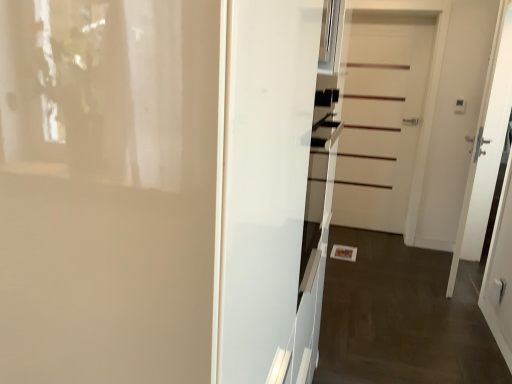
Question: Is white matte door at center, positioned as the 2th door in back-to-front order, wider than white matte door at center, marked as the 1th door in a back-to-front arrangement?

Choices:
 (A) no
 (B) yes

Answer: (B)

Question: Can you see white matte door at center, which ranks as the third door in left-to-right order, touching white matte door at center, the 2th door viewed from the left?

Choices:
 (A) no
 (B) yes

Answer: (A)

Question: From a real-world perspective, is white matte door at center, which ranks as the third door in left-to-right order, on top of white matte door at center, the 2th door viewed from the left?

Choices:
 (A) yes
 (B) no

Answer: (A)

Question: From the image's perspective, is white matte door at center, acting as the 2th door starting from the front, below white matte door at center, marked as the 1th door in a back-to-front arrangement?

Choices:
 (A) no
 (B) yes

Answer: (B)

Question: Is white matte door at center, positioned as the 2th door in back-to-front order, at the left side of white matte door at center, the 2th door viewed from the left?

Choices:
 (A) yes
 (B) no

Answer: (B)

Question: Considering the relative sizes of white matte door at center, acting as the 2th door starting from the front, and white matte door at center, marked as the 1th door in a back-to-front arrangement, in the image provided, is white matte door at center, acting as the 2th door starting from the front, bigger than white matte door at center, marked as the 1th door in a back-to-front arrangement,?

Choices:
 (A) no
 (B) yes

Answer: (B)

Question: Is white matte door at center, which appears as the third door when viewed from the front, facing towards white glossy oven at center?

Choices:
 (A) yes
 (B) no

Answer: (A)

Question: Is white matte door at center, which appears as the third door when viewed from the front, not within white glossy oven at center?

Choices:
 (A) no
 (B) yes

Answer: (B)

Question: Considering the relative sizes of white matte door at center, the 2th door viewed from the left, and white glossy oven at center in the image provided, is white matte door at center, the 2th door viewed from the left, bigger than white glossy oven at center?

Choices:
 (A) no
 (B) yes

Answer: (B)

Question: Considering the relative positions of white matte door at center, marked as the second door in a right-to-left arrangement, and white glossy oven at center in the image provided, is white matte door at center, marked as the second door in a right-to-left arrangement, to the left of white glossy oven at center from the viewer's perspective?

Choices:
 (A) yes
 (B) no

Answer: (B)

Question: Does white matte door at center, marked as the 1th door in a back-to-front arrangement, appear on the right side of white glossy oven at center?

Choices:
 (A) no
 (B) yes

Answer: (B)

Question: Is white matte door at center, marked as the second door in a right-to-left arrangement, thinner than white glossy oven at center?

Choices:
 (A) no
 (B) yes

Answer: (A)

Question: Considering the relative sizes of white glossy door at center, acting as the 1th door starting from the left, and white matte door at center, the 2th door viewed from the left, in the image provided, is white glossy door at center, acting as the 1th door starting from the left, taller than white matte door at center, the 2th door viewed from the left,?

Choices:
 (A) no
 (B) yes

Answer: (A)